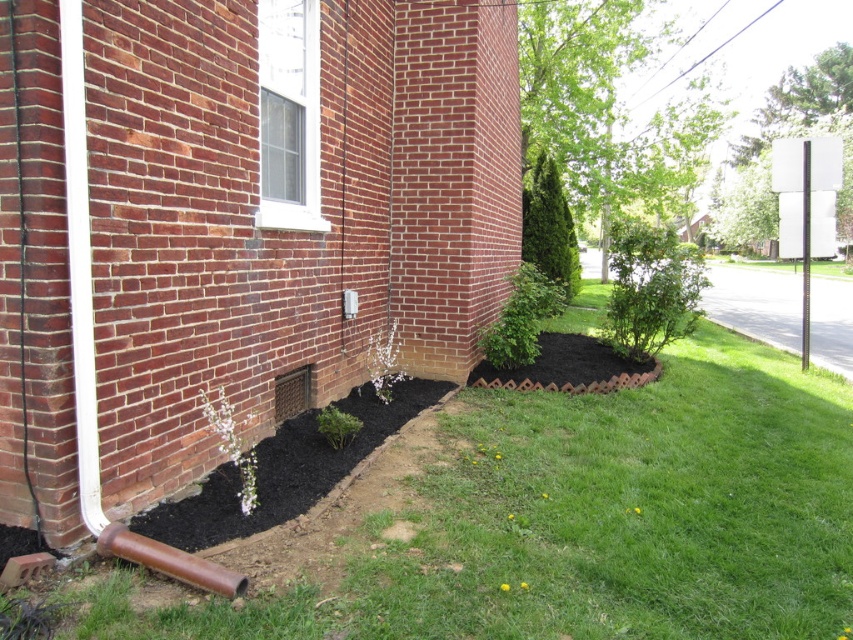
You are a gardener looking at the brick building exterior. You see green grass at lower center and black mulch at lower left. Which one is located to the right of the other?

The green grass at lower center is positioned on the right side of black mulch at lower left.

You are standing in front of the brick building and notice the green grass at lower center. Based on its position, can you determine if it is closer to the building or the mulched area?

The green grass at lower center is located at point (564,522), which places it closer to the building than the mulched area.